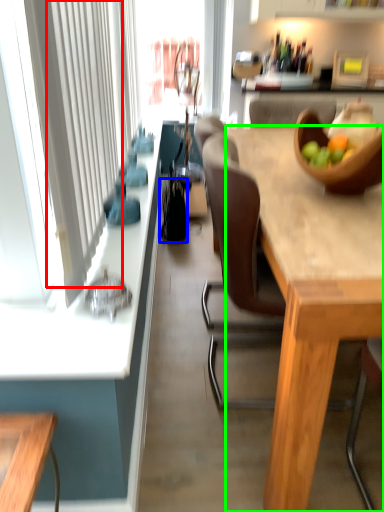
Question: Considering the real-world distances, which object is farthest from curtain (highlighted by a red box)? handbag (highlighted by a blue box) or desk (highlighted by a green box)?

Choices:
 (A) handbag
 (B) desk

Answer: (A)